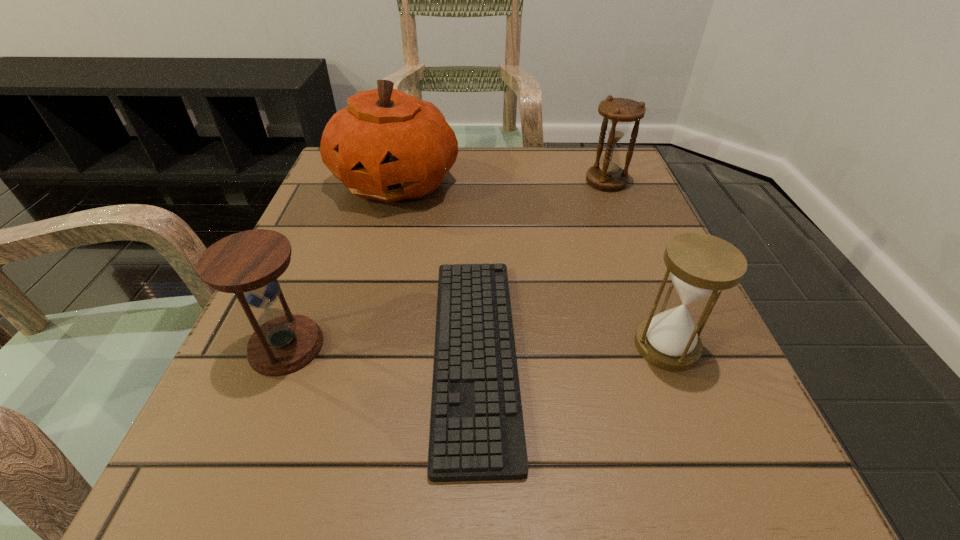
Identify the location of object present at the near edge. Image resolution: width=960 pixels, height=540 pixels. (477, 433).

Locate an element on the screen. The width and height of the screenshot is (960, 540). pumpkin present at the left edge is located at coordinates (387, 145).

Locate an element on the screen. This screenshot has height=540, width=960. hourglass located at the left edge is located at coordinates (248, 263).

Where is `object at the far left corner`? The width and height of the screenshot is (960, 540). object at the far left corner is located at coordinates (387, 145).

Find the location of a particular element. Image resolution: width=960 pixels, height=540 pixels. object at the far right corner is located at coordinates (619, 113).

Locate an element on the screen. The image size is (960, 540). free space at the far edge is located at coordinates (539, 192).

At what (x,y) coordinates should I click in order to perform the action: click on blank area at the near edge. Please return your answer as a coordinate pair (x, y). The image size is (960, 540). Looking at the image, I should click on point(598,510).

In the image, there is a desktop. Identify the location of vacant space at the left edge. This screenshot has height=540, width=960. (307, 228).

At what (x,y) coordinates should I click in order to perform the action: click on free space at the right edge of the desktop. Please return your answer as a coordinate pair (x, y). Looking at the image, I should click on (600, 299).

Image resolution: width=960 pixels, height=540 pixels. Find the location of `free space at the near left corner of the desktop`. free space at the near left corner of the desktop is located at coordinates (194, 447).